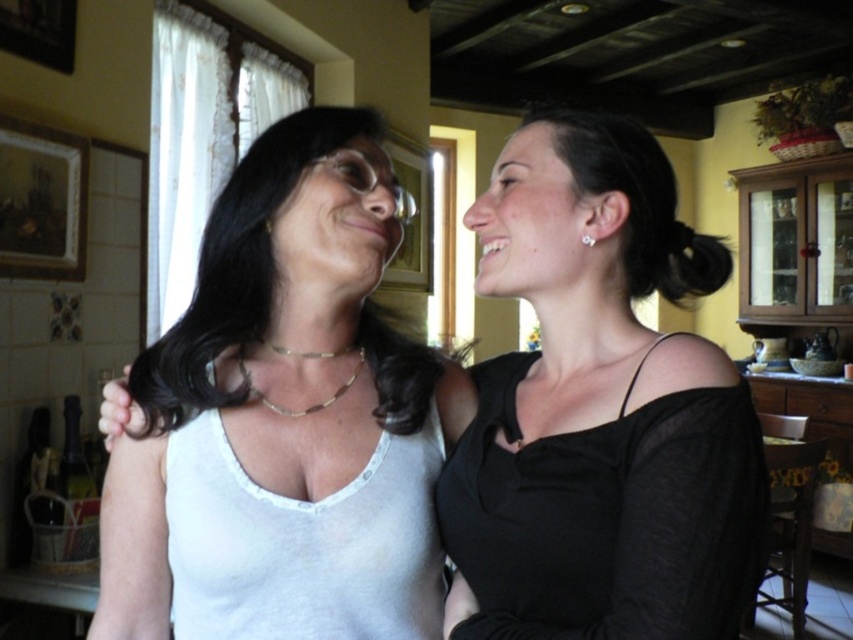
Looking at this image, you are a photographer setting up a shoot in this room. You want to focus on the white fabric tank top at center without the gold metallic necklace at upper center appearing too prominent. Which object should you position closer to the camera to achieve this?

To focus on the white fabric tank top at center and minimize the prominence of the gold metallic necklace at upper center, position the white fabric tank top at center closer to the camera. Since it is already closer than the necklace, adjusting its position further forward would help achieve the desired effect.

You are trying to decide which item to pack first for your trip. You have the white fabric tank top at center and the gold metallic necklace at upper center. Based on their sizes, which one should you consider packing first if you want to prioritize the larger item?

The white fabric tank top at center might be wider than gold metallic necklace at upper center, so you should pack the white fabric tank top at center first since it is likely larger.

You are a photographer trying to capture a closeup shot of the gold chain necklace at center. However, the black sheer dress at right is blocking your view. Can you adjust your position to get a clear shot without moving the subjects?

The black sheer dress at right is closer to the viewer than the gold chain necklace at center, so adjusting your position to the side or moving slightly back might allow you to see around the dress to capture the necklace.